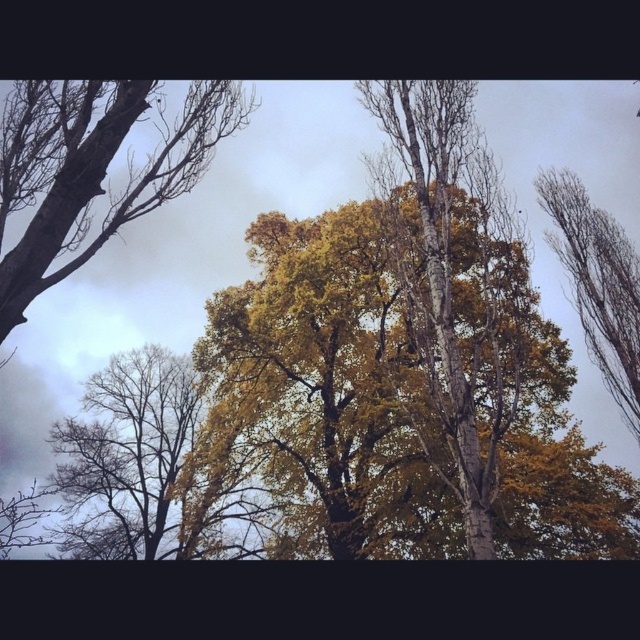
Question: Does smooth bark tree at upper left have a smaller size compared to bare branches at upper right?

Choices:
 (A) no
 (B) yes

Answer: (A)

Question: Is smooth bark tree at upper left further to the viewer compared to bare branches at upper right?

Choices:
 (A) no
 (B) yes

Answer: (A)

Question: Which of the following is the closest to the observer?

Choices:
 (A) (214, 122)
 (B) (625, 396)

Answer: (A)

Question: Is smooth bark tree at upper left positioned in front of bare branches at upper right?

Choices:
 (A) no
 (B) yes

Answer: (B)

Question: Which of the following is the closest to the observer?

Choices:
 (A) smooth bark tree at upper left
 (B) bare branches at upper right

Answer: (A)